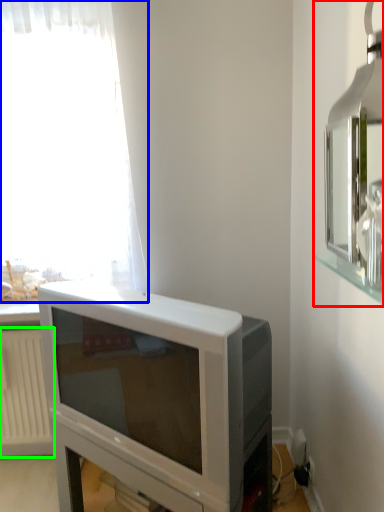
Question: Considering the real-world distances, which object is farthest from medicine cabinet (highlighted by a red box)? curtain (highlighted by a blue box) or radiator (highlighted by a green box)?

Choices:
 (A) curtain
 (B) radiator

Answer: (B)